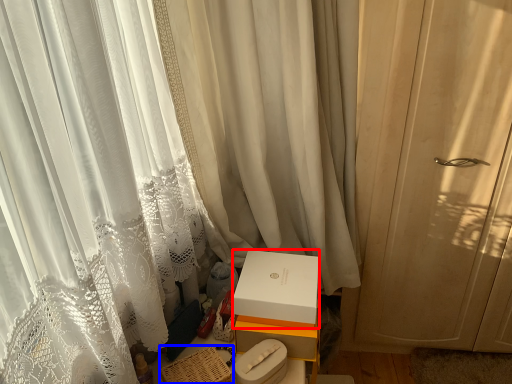
Question: Which point is closer to the camera, box (highlighted by a red box) or basket (highlighted by a blue box)?

Choices:
 (A) box
 (B) basket

Answer: (B)